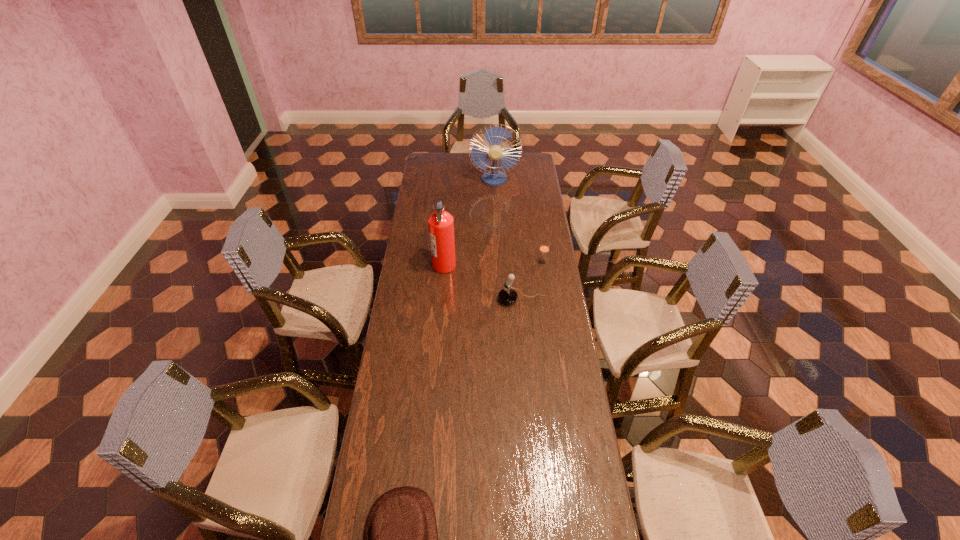
Identify the location of empty space that is in between the second shortest object and the fire extinguisher. Image resolution: width=960 pixels, height=540 pixels. (493, 264).

I want to click on vacant space in between the microphone and the fan, so pos(508,240).

The image size is (960, 540). I want to click on free space between the microphone and the straw, so click(x=533, y=281).

This screenshot has width=960, height=540. Find the location of `free space between the fourth farthest object and the fire extinguisher`. free space between the fourth farthest object and the fire extinguisher is located at coordinates (483, 282).

Identify which object is located as the third nearest to the shortest object. Please provide its 2D coordinates. Your answer should be formatted as a tuple, i.e. [(x, y)], where the tuple contains the x and y coordinates of a point satisfying the conditions above.

[(544, 248)]

This screenshot has width=960, height=540. I want to click on object that is the fourth closest one to the fire extinguisher, so click(401, 538).

Where is `free location that satisfies the following two spatial constraints: 1. on the back side of the fourth farthest object; 2. at the nozzle of the fire extinguisher`? The image size is (960, 540). free location that satisfies the following two spatial constraints: 1. on the back side of the fourth farthest object; 2. at the nozzle of the fire extinguisher is located at coordinates (518, 265).